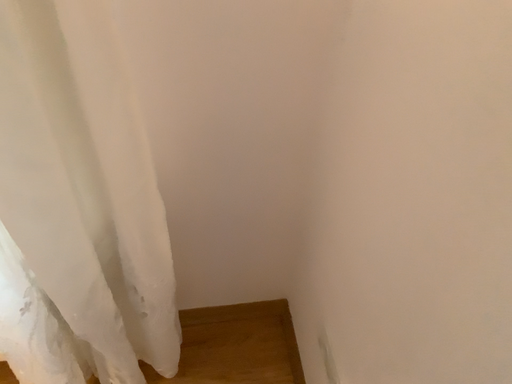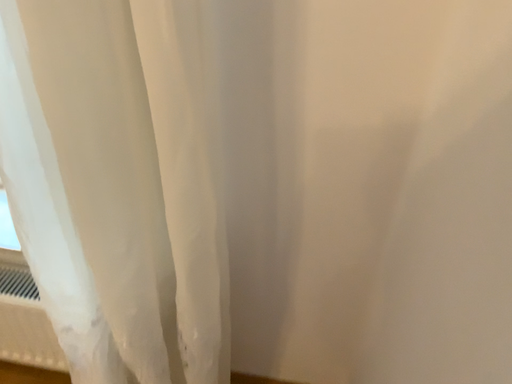
Question: Which way did the camera rotate in the video?

Choices:
 (A) rotated right
 (B) rotated left

Answer: (B)